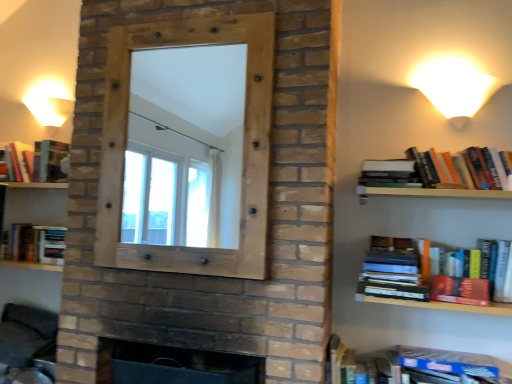
Question: Is hardcover book at lower left, the second book in the bottom-to-top sequence, taller or shorter than wooden frame at center?

Choices:
 (A) tall
 (B) short

Answer: (B)

Question: Is point (53, 263) positioned closer to the camera than point (109, 218)?

Choices:
 (A) closer
 (B) farther

Answer: (B)

Question: Estimate the real-world distances between objects in this image. Which object is farther from the dark gray fabric swivel chair at lower left?

Choices:
 (A) dark brick fireplace at center
 (B) hardcover book at upper right, positioned as the 3th book in top-to-bottom order
 (C) hardcover books at upper right, placed as the first book when sorted from right to left
 (D) matte white lampshade at upper left, the 2th table lamp viewed from the right
 (E) hardcover book at lower left, arranged as the fourth book when viewed from the right

Answer: (C)

Question: Which of these objects is positioned closest to the blue hardcover book at lower right, the 2th book in the right-to-left sequence?

Choices:
 (A) hardcover book at upper right, the 3th book ordered from the bottom
 (B) dark gray fabric swivel chair at lower left
 (C) hardcover book at lower left, the second book in the bottom-to-top sequence
 (D) dark brick fireplace at center
 (E) matte white lampshade at upper left, the 2th table lamp viewed from the right

Answer: (D)